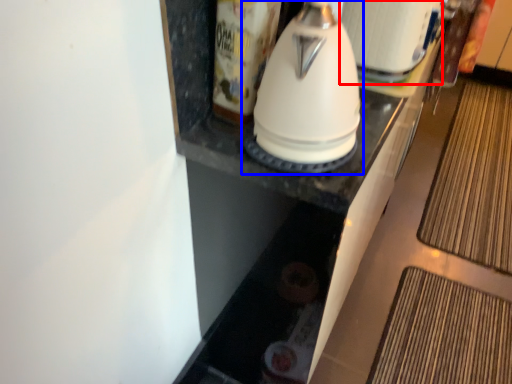
Question: Which of the following is the farthest to the observer, appliance (highlighted by a red box) or kitchen appliance (highlighted by a blue box)?

Choices:
 (A) appliance
 (B) kitchen appliance

Answer: (A)